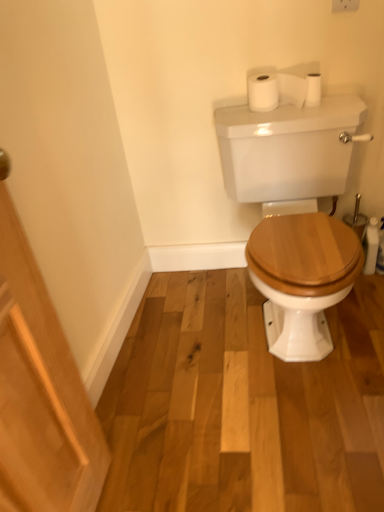
Question: Considering the relative sizes of white glossy porcelain at center and white matte toilet paper at upper right, the 2th toilet paper viewed from the left, in the image provided, is white glossy porcelain at center thinner than white matte toilet paper at upper right, the 2th toilet paper viewed from the left,?

Choices:
 (A) yes
 (B) no

Answer: (B)

Question: From a real-world perspective, is white glossy porcelain at center over white matte toilet paper at upper right, the first toilet paper when ordered from right to left?

Choices:
 (A) no
 (B) yes

Answer: (A)

Question: Is white glossy porcelain at center next to white matte toilet paper at upper right, the 2th toilet paper viewed from the left?

Choices:
 (A) no
 (B) yes

Answer: (A)

Question: Is white glossy porcelain at center in front of white matte toilet paper at upper right, the 2th toilet paper viewed from the left?

Choices:
 (A) no
 (B) yes

Answer: (B)

Question: Can you confirm if white glossy porcelain at center is smaller than white matte toilet paper at upper right, the first toilet paper when ordered from right to left?

Choices:
 (A) yes
 (B) no

Answer: (B)

Question: From the image's perspective, would you say white glossy porcelain at center is positioned over white matte toilet paper at upper right, the 2th toilet paper viewed from the left?

Choices:
 (A) yes
 (B) no

Answer: (B)

Question: Can you confirm if white matte toilet paper at upper right, the 2th toilet paper viewed from the left, is taller than white matte toilet paper at upper center, which is counted as the second toilet paper, starting from the right?

Choices:
 (A) no
 (B) yes

Answer: (A)

Question: Considering the relative positions of white matte toilet paper at upper right, the 2th toilet paper viewed from the left, and white matte toilet paper at upper center, which is counted as the second toilet paper, starting from the right, in the image provided, is white matte toilet paper at upper right, the 2th toilet paper viewed from the left, to the right of white matte toilet paper at upper center, which is counted as the second toilet paper, starting from the right, from the viewer's perspective?

Choices:
 (A) yes
 (B) no

Answer: (A)

Question: From a real-world perspective, is white matte toilet paper at upper right, the first toilet paper when ordered from right to left, located beneath white matte toilet paper at upper center, which is the 1th toilet paper from left to right?

Choices:
 (A) yes
 (B) no

Answer: (A)

Question: Is white matte toilet paper at upper right, the 2th toilet paper viewed from the left, directly adjacent to white matte toilet paper at upper center, which is counted as the second toilet paper, starting from the right?

Choices:
 (A) yes
 (B) no

Answer: (A)

Question: Is white matte toilet paper at upper right, the 2th toilet paper viewed from the left, outside white matte toilet paper at upper center, which is counted as the second toilet paper, starting from the right?

Choices:
 (A) yes
 (B) no

Answer: (A)

Question: Considering the relative positions of white matte toilet paper at upper right, the 2th toilet paper viewed from the left, and white matte toilet paper at upper center, which is counted as the second toilet paper, starting from the right, in the image provided, is white matte toilet paper at upper right, the 2th toilet paper viewed from the left, to the left of white matte toilet paper at upper center, which is counted as the second toilet paper, starting from the right, from the viewer's perspective?

Choices:
 (A) no
 (B) yes

Answer: (A)

Question: Is white matte toilet paper at upper center, which is counted as the second toilet paper, starting from the right, shorter than white matte toilet paper at upper right, the 2th toilet paper viewed from the left?

Choices:
 (A) yes
 (B) no

Answer: (B)